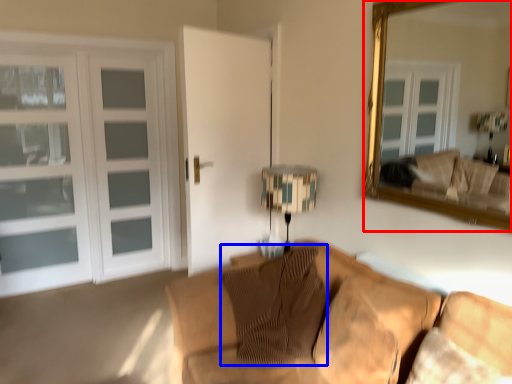
Question: Which of the following is the closest to the observer, mirror (highlighted by a red box) or pillow (highlighted by a blue box)?

Choices:
 (A) mirror
 (B) pillow

Answer: (A)